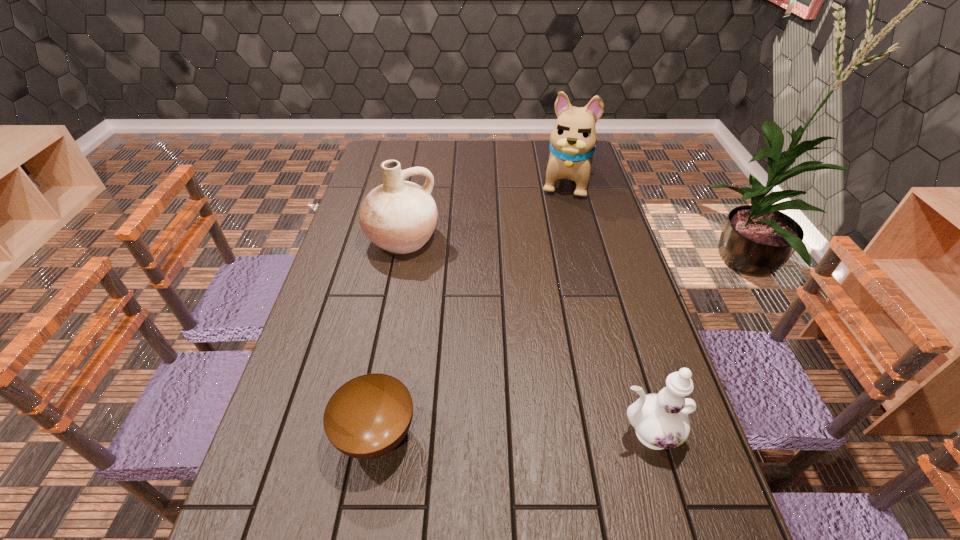
This screenshot has height=540, width=960. In order to click on bowl in this screenshot , I will do `click(367, 417)`.

Find the location of a particular element. chinaware is located at coordinates (660, 420).

What are the coordinates of `the second farthest object` in the screenshot? It's located at (399, 216).

Find the location of a particular element. the tallest object is located at coordinates (572, 141).

The height and width of the screenshot is (540, 960). Find the location of `the farthest object`. the farthest object is located at coordinates (572, 141).

Find the location of `free region located on the right of the shortest object`. free region located on the right of the shortest object is located at coordinates pos(464,435).

Where is `vacant area situated 0.230m at the spout of the chinaware`? The width and height of the screenshot is (960, 540). vacant area situated 0.230m at the spout of the chinaware is located at coordinates (506, 433).

Identify the location of free space located at the spout of the chinaware. (506, 433).

Locate an element on the screen. The height and width of the screenshot is (540, 960). vacant space situated 0.320m at the spout of the chinaware is located at coordinates (464, 433).

I want to click on vacant space located to pour from the handle of the pottery, so click(x=439, y=319).